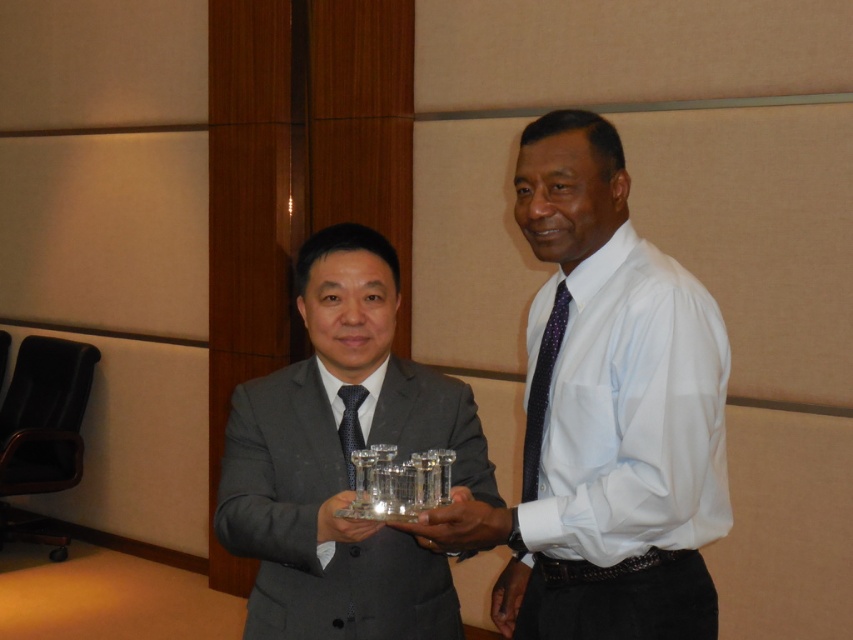
From the picture: You are a photographer at a formal event and need to capture a clear photo of the white glossy shirt at center and the matte black suit at center. Which one might reflect more light and why?

The white glossy shirt at center is positioned over matte black suit at center, so it reflects more light due to its glossy surface compared to the matte finish of the suit.

You are a photographer at a formal event. You need to capture a clear photo of both the white glossy shirt at center and the dark blue textured tie at center. Which object should you focus on first to ensure both are in frame?

The white glossy shirt at center is positioned on the right side of dark blue textured tie at center. To ensure both are in frame, focus on the dark blue textured tie at center first since it is on the left, allowing the camera to capture both objects as you adjust the framing.

You are a photographer setting up for a group photo. You need to ensure that the white glossy shirt at center and the dark blue textured tie at center are both in focus. Given that your camera has a depth of field that can cover objects within 20 inches of each other, will both items be in focus?

The white glossy shirt at center is 21.48 inches from the dark blue textured tie at center. Since the distance exceeds the camera depth of field coverage of 20 inches, the two items may not both be in focus simultaneously.